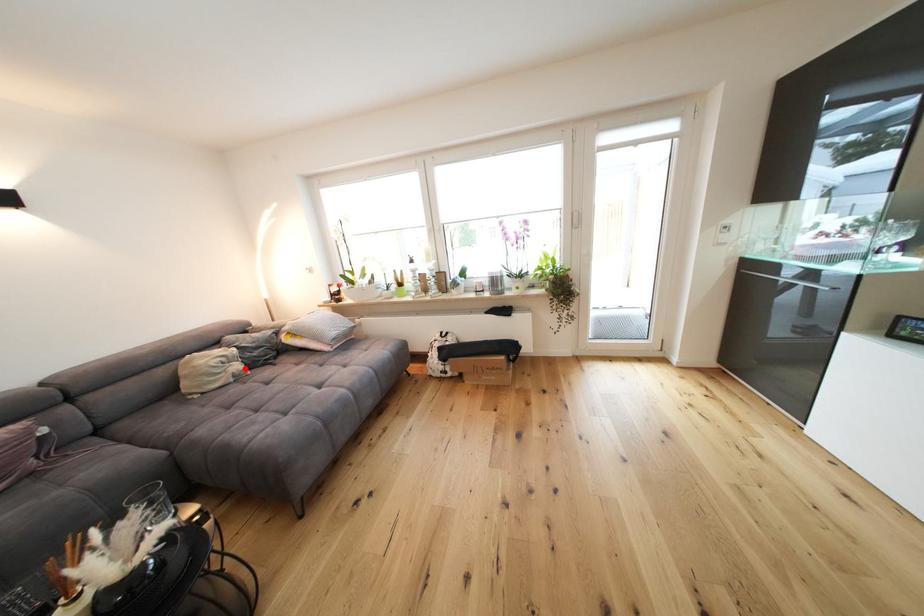
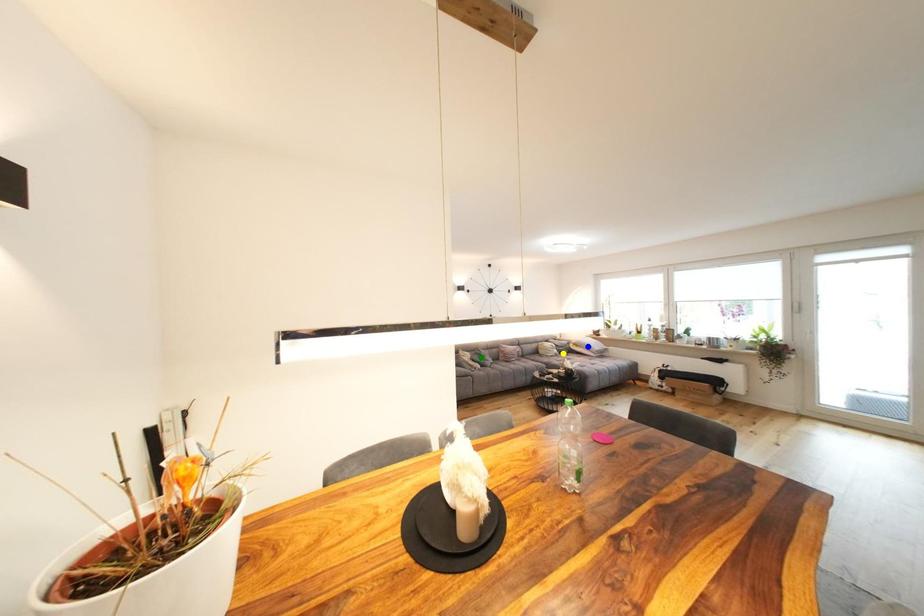
Question: I am providing you with two images of the same scene from different viewpoints. A red point is marked on the first image. You are given multiple points on the second image. In image 2, which mark is for the same physical point as the one in image 1?

Choices:
 (A) green point
 (B) yellow point
 (C) blue point

Answer: (B)